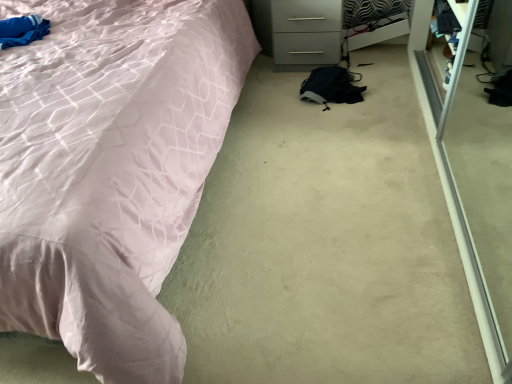
Question: Is matte pink fabric bed at left directly adjacent to white glossy drawer at upper right?

Choices:
 (A) yes
 (B) no

Answer: (B)

Question: Is matte pink fabric bed at left taller than white glossy drawer at upper right?

Choices:
 (A) yes
 (B) no

Answer: (A)

Question: Could you tell me if matte pink fabric bed at left is facing white glossy drawer at upper right?

Choices:
 (A) no
 (B) yes

Answer: (A)

Question: Considering the relative sizes of matte pink fabric bed at left and white glossy drawer at upper right in the image provided, is matte pink fabric bed at left thinner than white glossy drawer at upper right?

Choices:
 (A) yes
 (B) no

Answer: (B)

Question: Is matte pink fabric bed at left completely or partially outside of white glossy drawer at upper right?

Choices:
 (A) yes
 (B) no

Answer: (A)

Question: Is matte pink fabric bed at left behind white glossy drawer at upper right?

Choices:
 (A) no
 (B) yes

Answer: (A)

Question: From a real-world perspective, is white glossy drawer at upper right located higher than matte pink fabric bed at left?

Choices:
 (A) yes
 (B) no

Answer: (B)

Question: Can you confirm if white glossy drawer at upper right is wider than matte pink fabric bed at left?

Choices:
 (A) yes
 (B) no

Answer: (B)

Question: From the image's perspective, is white glossy drawer at upper right over matte pink fabric bed at left?

Choices:
 (A) no
 (B) yes

Answer: (B)

Question: Is white glossy drawer at upper right positioned far away from matte pink fabric bed at left?

Choices:
 (A) yes
 (B) no

Answer: (B)

Question: From a real-world perspective, is white glossy drawer at upper right beneath matte pink fabric bed at left?

Choices:
 (A) no
 (B) yes

Answer: (B)

Question: Can you confirm if white glossy drawer at upper right is shorter than matte pink fabric bed at left?

Choices:
 (A) yes
 (B) no

Answer: (A)

Question: Is point [x=316, y=56] closer or farther from the camera than point [x=138, y=168]?

Choices:
 (A) farther
 (B) closer

Answer: (A)